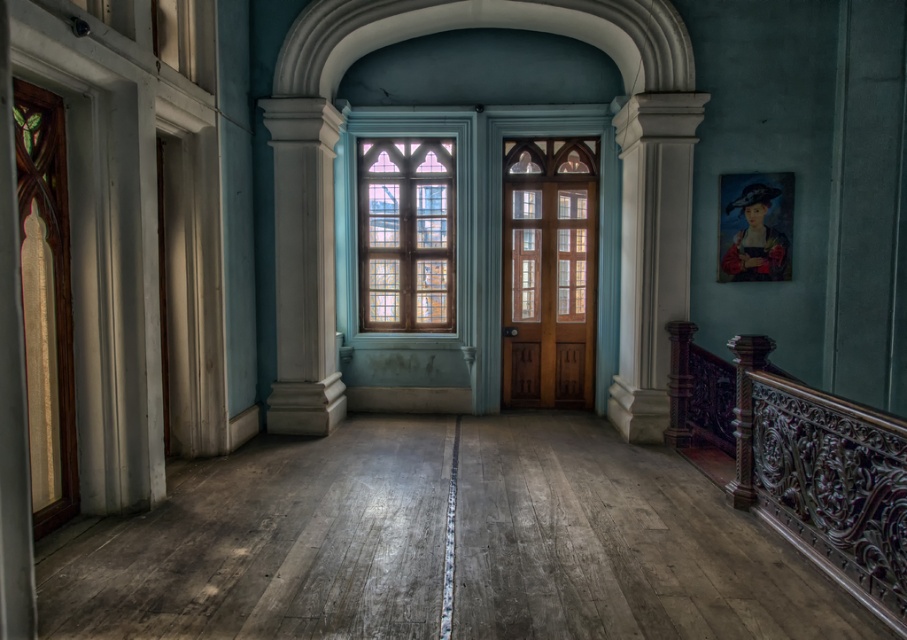
Based on the photo, who is taller, dark wood carved railing at right or wooden door at center?

wooden door at center is taller.

Can you confirm if dark wood carved railing at right is positioned below wooden door at center?

Correct, dark wood carved railing at right is located below wooden door at center.

I want to click on dark wood carved railing at right, so click(x=800, y=461).

Does dark wood carved railing at right have a smaller size compared to stained glass window at center?

No, dark wood carved railing at right is not smaller than stained glass window at center.

Is point (793, 417) behind point (441, 324)?

No, (793, 417) is in front of (441, 324).

The image size is (907, 640). Find the location of `dark wood carved railing at right`. dark wood carved railing at right is located at coordinates [800, 461].

Is the position of wooden door at center less distant than that of stained glass window at center?

Yes, wooden door at center is in front of stained glass window at center.

Is point (576, 186) positioned in front of point (413, 205)?

Yes, point (576, 186) is closer to viewer.

Where is `wooden door at center`? The height and width of the screenshot is (640, 907). wooden door at center is located at coordinates (549, 272).